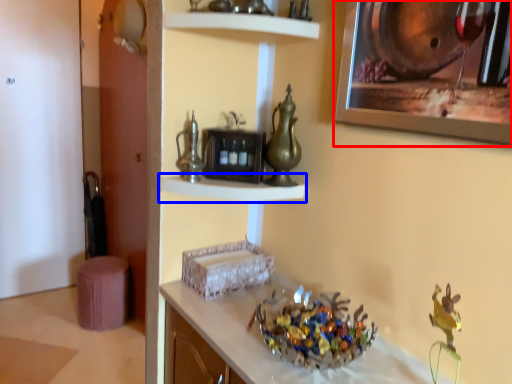
Question: Which of the following is the farthest to the observer, picture frame (highlighted by a red box) or shelf (highlighted by a blue box)?

Choices:
 (A) picture frame
 (B) shelf

Answer: (B)